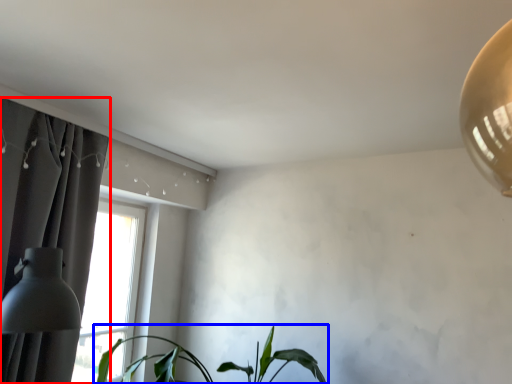
Question: Among these objects, which one is farthest to the camera, curtain (highlighted by a red box) or houseplant (highlighted by a blue box)?

Choices:
 (A) curtain
 (B) houseplant

Answer: (B)